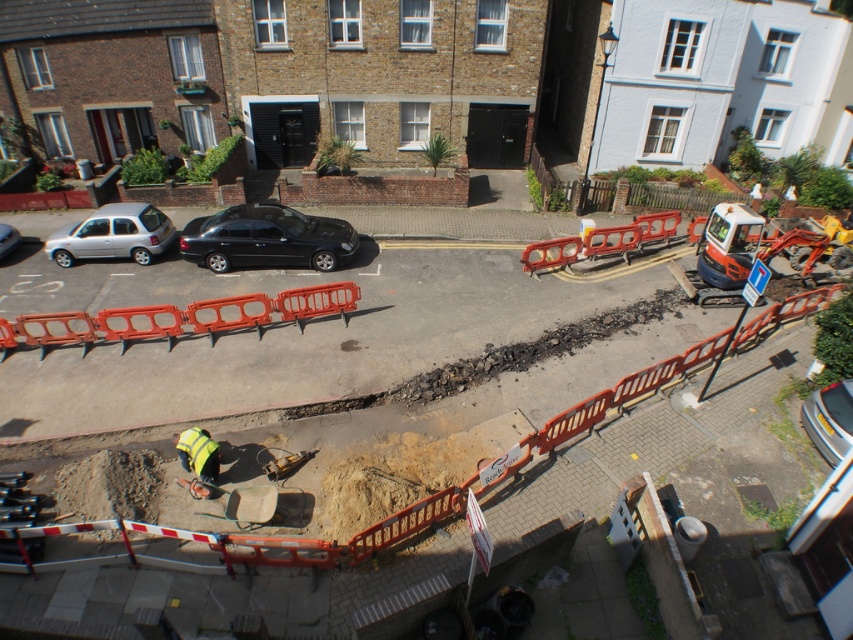
Question: Can you confirm if orange plastic barrier at center is wider than black glossy sedan at center?

Choices:
 (A) no
 (B) yes

Answer: (B)

Question: Which point is closer to the camera taking this photo?

Choices:
 (A) (210, 323)
 (B) (0, 237)

Answer: (A)

Question: Is orange plastic barrier at center smaller than silver metallic car at left?

Choices:
 (A) no
 (B) yes

Answer: (A)

Question: Which point is closer to the camera?

Choices:
 (A) (334, 236)
 (B) (815, 406)
 (C) (134, 323)

Answer: (B)

Question: Which point is farther from the camera taking this photo?

Choices:
 (A) (154, 323)
 (B) (151, 250)

Answer: (B)

Question: Can you confirm if orange plastic barricade at center is positioned above silver metallic car at left?

Choices:
 (A) no
 (B) yes

Answer: (A)